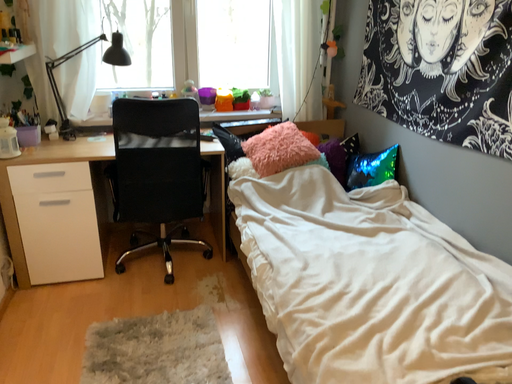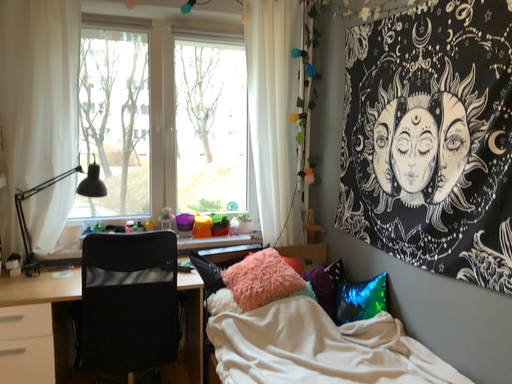
Question: How did the camera likely rotate when shooting the video?

Choices:
 (A) rotated upward
 (B) rotated downward

Answer: (A)